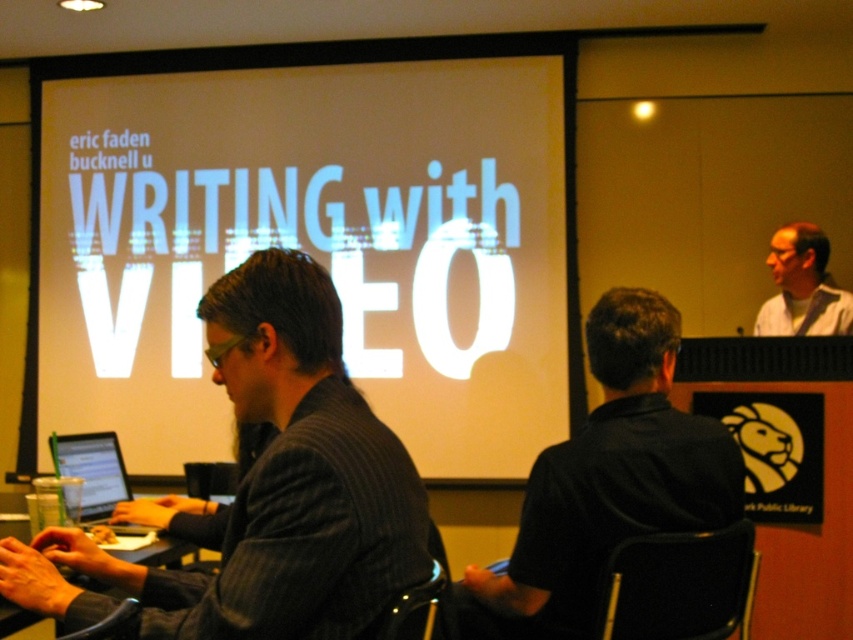
You are standing in the workshop and want to take a photo of the projection screen. There are two points marked on the screen at coordinates point (74,449) and point (7,515). Which point is closer to the camera so that it will appear larger in the photo?

Point (74,449) is closer to the camera than point (7,515), so it will appear larger in the photo.